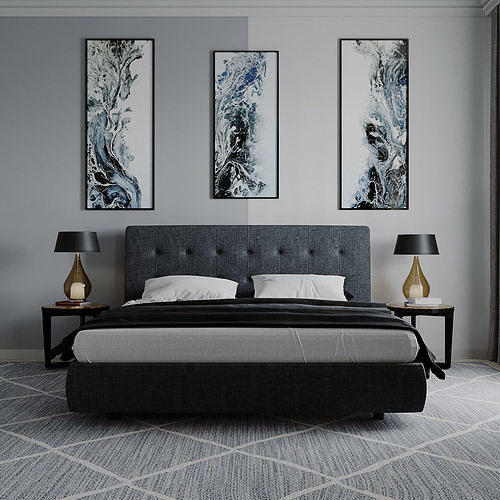
The height and width of the screenshot is (500, 500). I want to click on lamp, so click(76, 276), click(414, 278).